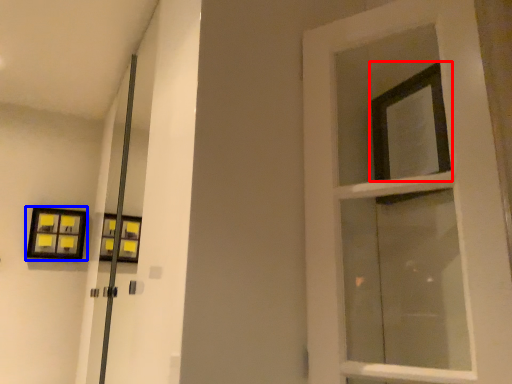
Question: Which object appears closest to the camera in this image, window (highlighted by a red box) or picture frame (highlighted by a blue box)?

Choices:
 (A) window
 (B) picture frame

Answer: (A)